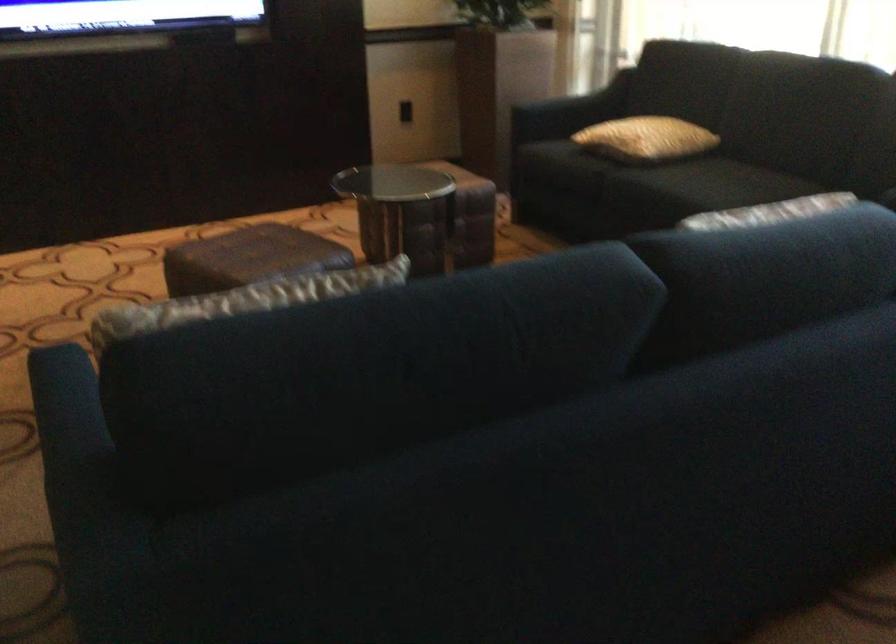
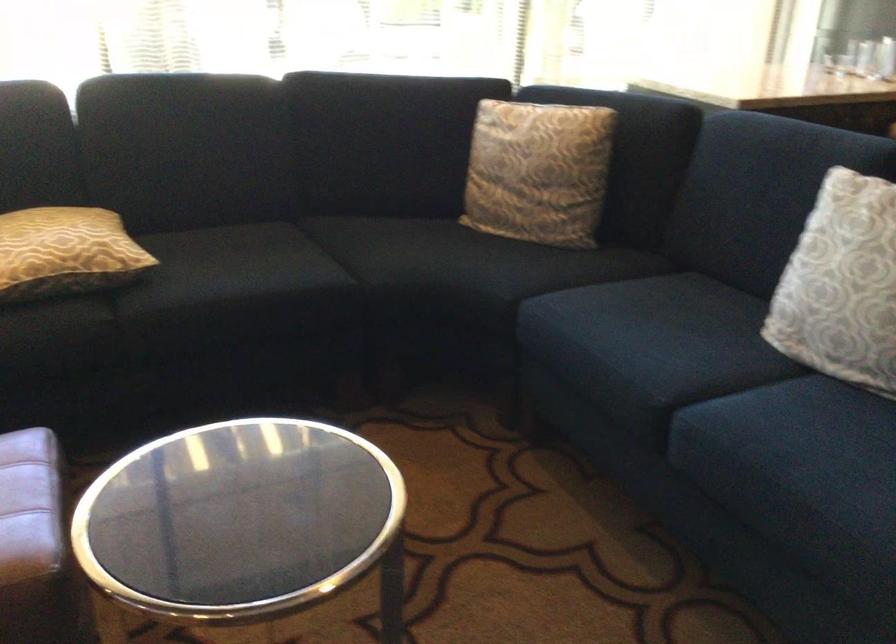
Where in the second image is the point corresponding to point 617,131 from the first image?

(65, 252)